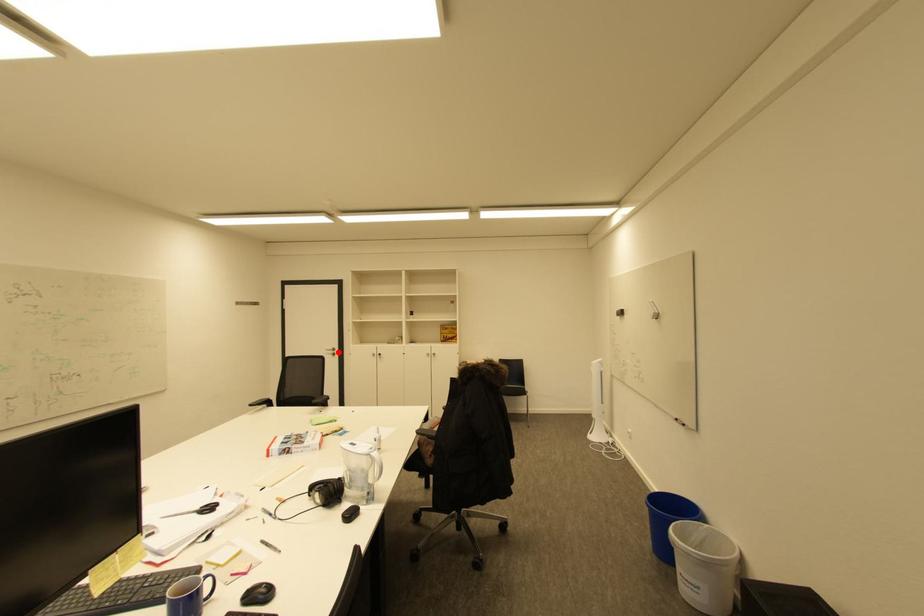
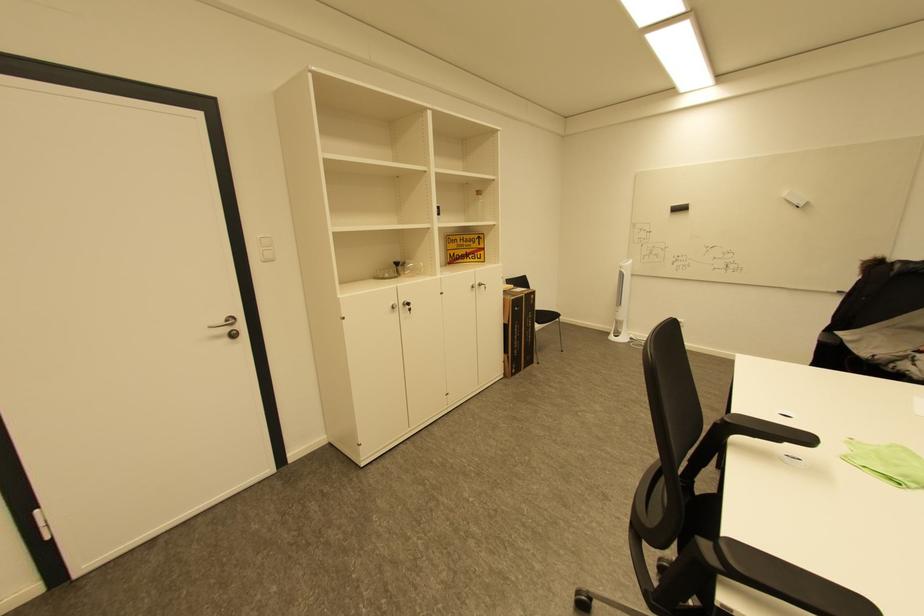
Question: A red point is marked in image1. In image2, is the corresponding 3D point closer to the camera or farther? Reply with the corresponding letter.

Choices:
 (A) The corresponding 3D point is closer.
 (B) The corresponding 3D point is farther.

Answer: (A)